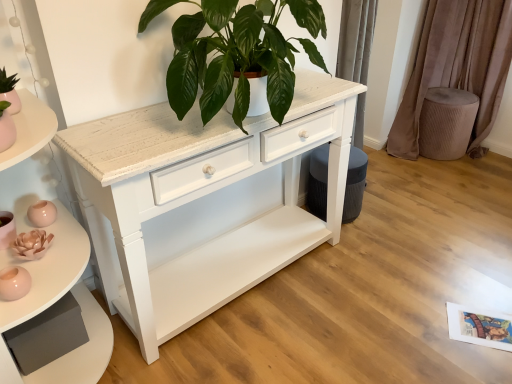
Find the location of a particular element. Image resolution: width=512 pixels, height=384 pixels. vacant space in front of velvet taupe curtain at right is located at coordinates (471, 168).